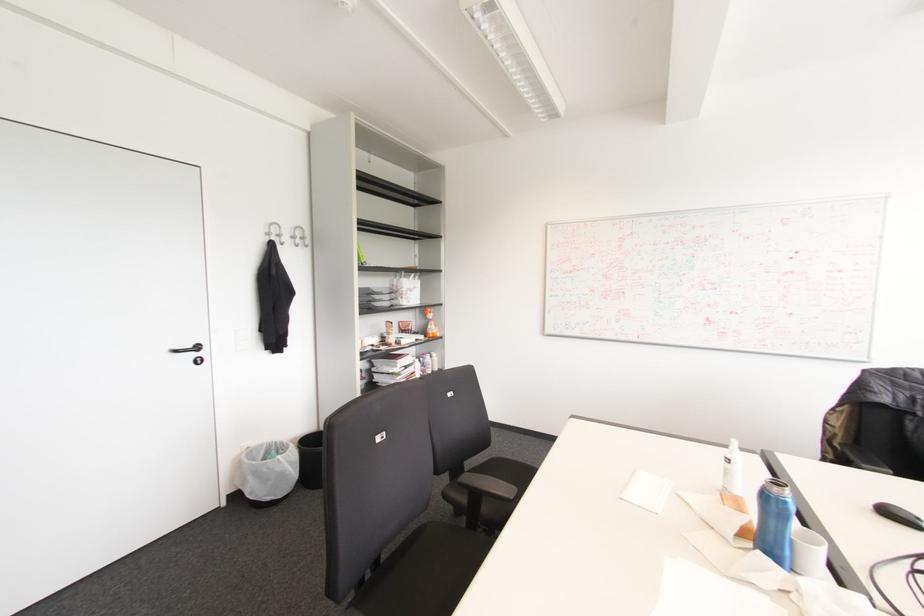
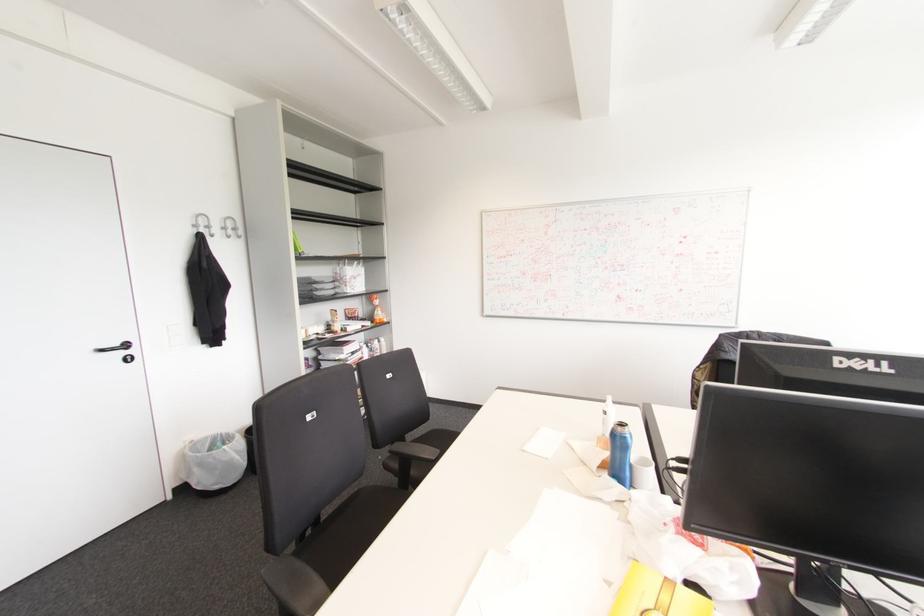
Find the pixel in the second image that matches (520,475) in the first image.

(444, 439)